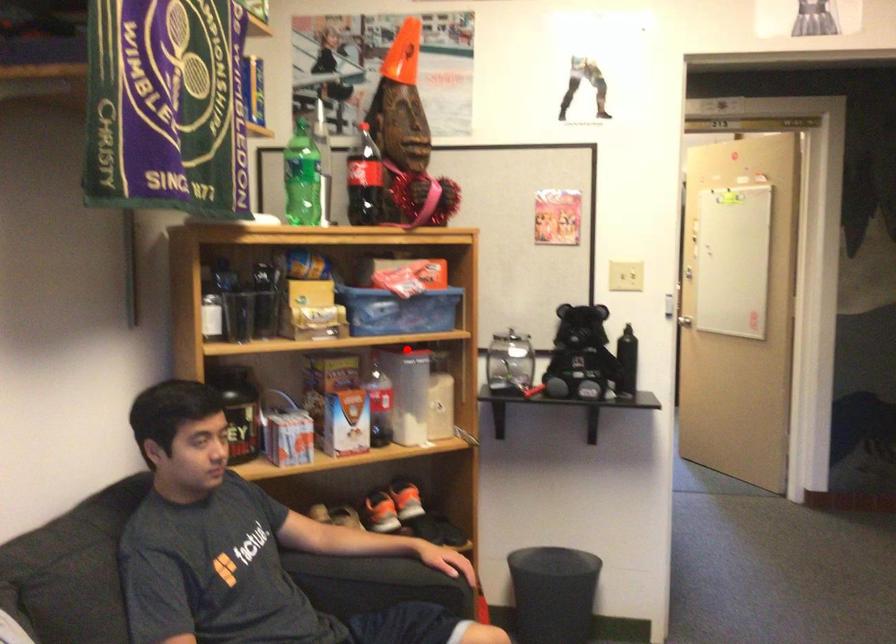
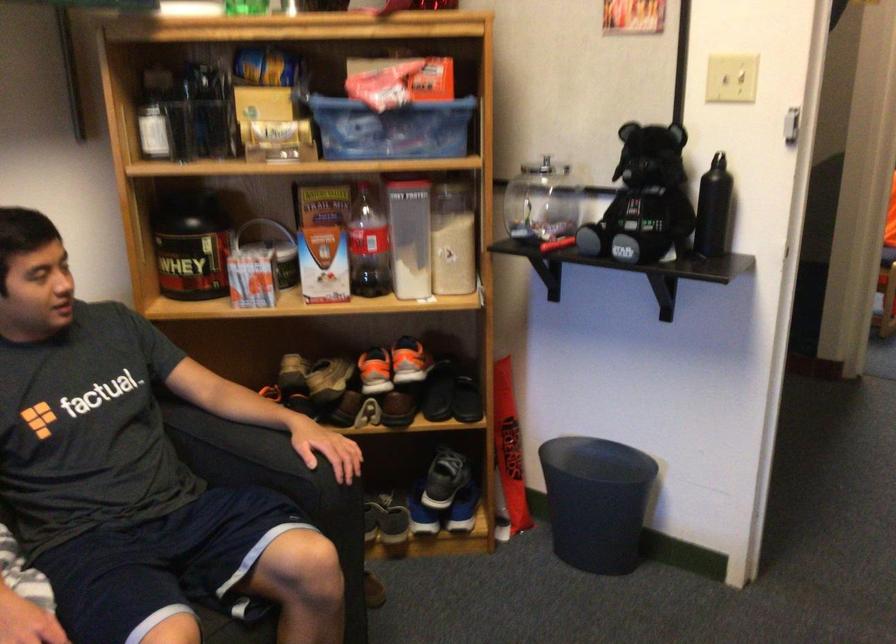
The point at the highlighted location is marked in the first image. Where is the corresponding point in the second image?

(405, 178)